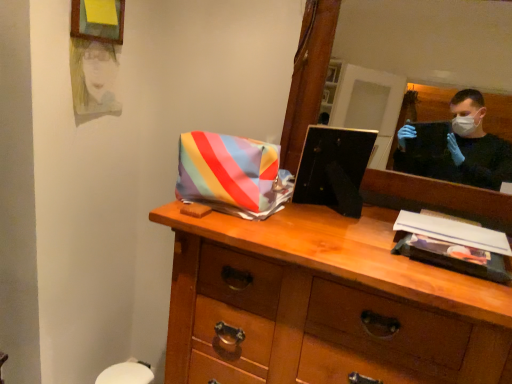
The image size is (512, 384). In order to click on wooden chest of drawers at center in this screenshot , I will do tap(325, 304).

What do you see at coordinates (98, 20) in the screenshot? I see `matte yellow picture frame at upper left` at bounding box center [98, 20].

What are the coordinates of `wooden chest of drawers at center` in the screenshot? It's located at pos(325,304).

Can you confirm if matte yellow picture frame at upper left is bigger than watercolor portrait at upper left?

Actually, matte yellow picture frame at upper left might be smaller than watercolor portrait at upper left.

Is point (76, 3) closer or farther from the camera than point (84, 91)?

Clearly, point (76, 3) is closer to the camera than point (84, 91).

Which object is thinner, matte yellow picture frame at upper left or watercolor portrait at upper left?

watercolor portrait at upper left is thinner.

Would you say matte yellow picture frame at upper left is outside watercolor portrait at upper left?

matte yellow picture frame at upper left is positioned outside watercolor portrait at upper left.

The width and height of the screenshot is (512, 384). I want to click on chest of drawers on the right of matte yellow picture frame at upper left, so click(x=325, y=304).

Could wooden chest of drawers at center be considered to be inside matte yellow picture frame at upper left?

No, matte yellow picture frame at upper left does not contain wooden chest of drawers at center.

Would you say matte yellow picture frame at upper left is to the left or to the right of wooden chest of drawers at center in the picture?

In the image, matte yellow picture frame at upper left appears on the left side of wooden chest of drawers at center.

Consider the image. Between wooden mirror at upper right and watercolor portrait at upper left, which one has less height?

watercolor portrait at upper left is shorter.

Which point is more distant from viewer, (414, 70) or (92, 111)?

The point (414, 70) is behind.

From the picture: From a real-world perspective, between wooden mirror at upper right and watercolor portrait at upper left, who is vertically higher?

wooden mirror at upper right, from a real-world perspective.

Would you consider wooden mirror at upper right to be distant from watercolor portrait at upper left?

Absolutely, wooden mirror at upper right is distant from watercolor portrait at upper left.

From a real-world perspective, is watercolor portrait at upper left physically above matte yellow picture frame at upper left?

No, from a real-world perspective, watercolor portrait at upper left is not above matte yellow picture frame at upper left.

The width and height of the screenshot is (512, 384). Find the location of `picture frame above the watercolor portrait at upper left (from a real-world perspective)`. picture frame above the watercolor portrait at upper left (from a real-world perspective) is located at coordinates (98, 20).

Is matte yellow picture frame at upper left inside watercolor portrait at upper left?

No, matte yellow picture frame at upper left is not a part of watercolor portrait at upper left.

In terms of width, does watercolor portrait at upper left look wider or thinner when compared to matte yellow picture frame at upper left?

In the image, watercolor portrait at upper left appears to be more narrow than matte yellow picture frame at upper left.

Is matte yellow picture frame at upper left positioned with its back to wooden mirror at upper right?

No, wooden mirror at upper right is not at the back of matte yellow picture frame at upper left.

From the image's perspective, which object appears higher, matte yellow picture frame at upper left or wooden mirror at upper right?

matte yellow picture frame at upper left, from the image's perspective.

Measure the distance between matte yellow picture frame at upper left and wooden mirror at upper right.

A distance of 8.04 feet exists between matte yellow picture frame at upper left and wooden mirror at upper right.

Considering the relative sizes of matte yellow picture frame at upper left and wooden mirror at upper right in the image provided, is matte yellow picture frame at upper left thinner than wooden mirror at upper right?

Yes.

Is wooden chest of drawers at center positioned with its back to wooden mirror at upper right?

No, wooden chest of drawers at center is not facing the opposite direction of wooden mirror at upper right.

Is wooden chest of drawers at center outside of wooden mirror at upper right?

That's correct, wooden chest of drawers at center is outside of wooden mirror at upper right.

I want to click on mirror on the right of wooden chest of drawers at center, so click(430, 40).

Who is smaller, wooden chest of drawers at center or wooden mirror at upper right?

With smaller size is wooden mirror at upper right.

Could you tell me if watercolor portrait at upper left is facing wooden mirror at upper right?

Yes.

Is watercolor portrait at upper left surrounding wooden mirror at upper right?

Actually, wooden mirror at upper right is outside watercolor portrait at upper left.

Does watercolor portrait at upper left lie in front of wooden mirror at upper right?

No, watercolor portrait at upper left is further to the viewer.

Looking at this image, is watercolor portrait at upper left positioned far away from wooden mirror at upper right?

Yes.

Identify the location of person behind the matte yellow picture frame at upper left. The image size is (512, 384). (93, 76).

At what (x,y) coordinates should I click in order to perform the action: click on chest of drawers below the matte yellow picture frame at upper left (from the image's perspective). Please return your answer as a coordinate pair (x, y). The width and height of the screenshot is (512, 384). Looking at the image, I should click on tap(325, 304).

Considering their positions, is wooden chest of drawers at center positioned closer to matte yellow picture frame at upper left than wooden mirror at upper right?

The object closer to matte yellow picture frame at upper left is wooden chest of drawers at center.

Estimate the real-world distances between objects in this image. Which object is closer to watercolor portrait at upper left, matte yellow picture frame at upper left or wooden mirror at upper right?

matte yellow picture frame at upper left lies closer to watercolor portrait at upper left than the other object.

From the picture: When comparing their distances from watercolor portrait at upper left, does matte yellow picture frame at upper left or wooden chest of drawers at center seem closer?

Among the two, matte yellow picture frame at upper left is located nearer to watercolor portrait at upper left.

Looking at the image, which one is located further to wooden mirror at upper right, wooden chest of drawers at center or watercolor portrait at upper left?

wooden chest of drawers at center lies further to wooden mirror at upper right than the other object.

Looking at the image, which one is located further to matte yellow picture frame at upper left, wooden chest of drawers at center or watercolor portrait at upper left?

wooden chest of drawers at center.

Looking at the image, which one is located closer to wooden chest of drawers at center, watercolor portrait at upper left or matte yellow picture frame at upper left?

Among the two, watercolor portrait at upper left is located nearer to wooden chest of drawers at center.

Based on their spatial positions, is wooden mirror at upper right or matte yellow picture frame at upper left further from wooden chest of drawers at center?

wooden mirror at upper right.

Estimate the real-world distances between objects in this image. Which object is further from matte yellow picture frame at upper left, wooden mirror at upper right or wooden chest of drawers at center?

Among the two, wooden mirror at upper right is located further to matte yellow picture frame at upper left.

In order to click on picture frame between watercolor portrait at upper left and wooden mirror at upper right from left to right in this screenshot , I will do [x=98, y=20].

Find the location of a particular element. The width and height of the screenshot is (512, 384). person between matte yellow picture frame at upper left and wooden chest of drawers at center from top to bottom is located at coordinates (93, 76).

The height and width of the screenshot is (384, 512). I want to click on mirror between matte yellow picture frame at upper left and wooden chest of drawers at center from top to bottom, so click(430, 40).

Find the location of a particular element. The height and width of the screenshot is (384, 512). chest of drawers between watercolor portrait at upper left and wooden mirror at upper right in the horizontal direction is located at coordinates (325, 304).